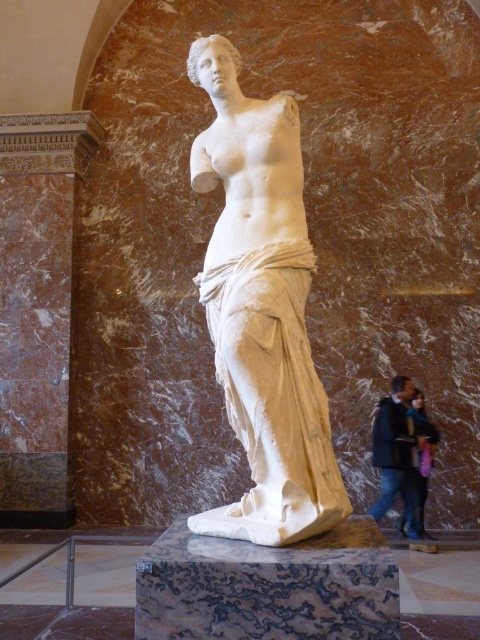
You are standing in a museum and want to take a photo of the classical marble statue. The statue is at point (x=238, y=156). If your camera has a maximum focus range of 4 meters, will you be able to focus on the statue?

The distance of point (x=238, y=156) from the camera is 4.43 meters, which exceeds the camera maximum focus range of 4 meters. Therefore, you won not be able to focus on the statue.

You are an art curator planning to move the dark blue jacket at lower right closer to the white marble statue at center. Considering their widths, will the jacket fit next to the statue without overlapping?

The white marble statue at center is wider than the dark blue jacket at lower right. Since the statue is wider, there should be enough space to place the jacket next to it without overlapping, provided the available floor area accommodates both items.

You are standing in front of the classical marble statue in the museum. There are two points marked on the statue, one at coordinate point [256,109] and the other at point [47,492]. Which of these points is nearer to you?

Point [256,109] is closer to the viewer than point [47,492].